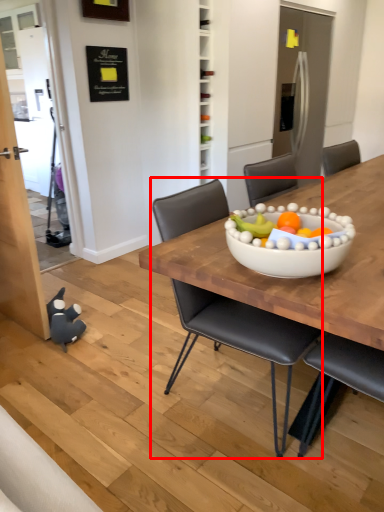
Question: In this image, where is chair (annotated by the red box) located relative to toy?

Choices:
 (A) left
 (B) right

Answer: (B)